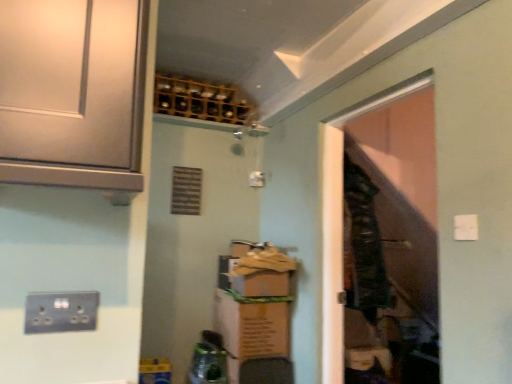
Question: Is dark green fabric laundry at center completely or partially inside metallic socket at lower left?

Choices:
 (A) yes
 (B) no

Answer: (B)

Question: Is metallic socket at lower left to the left of dark green fabric laundry at center from the viewer's perspective?

Choices:
 (A) yes
 (B) no

Answer: (A)

Question: Is metallic socket at lower left not within dark green fabric laundry at center?

Choices:
 (A) yes
 (B) no

Answer: (A)

Question: Is metallic socket at lower left wider than dark green fabric laundry at center?

Choices:
 (A) no
 (B) yes

Answer: (A)

Question: Can you confirm if metallic socket at lower left is thinner than dark green fabric laundry at center?

Choices:
 (A) no
 (B) yes

Answer: (B)

Question: In the image, is metallic socket at lower left positioned in front of or behind white plastic light switch at upper right?

Choices:
 (A) behind
 (B) front

Answer: (B)

Question: Is metallic socket at lower left taller or shorter than white plastic light switch at upper right?

Choices:
 (A) short
 (B) tall

Answer: (B)

Question: From a real-world perspective, is metallic socket at lower left positioned above or below white plastic light switch at upper right?

Choices:
 (A) below
 (B) above

Answer: (A)

Question: In terms of width, does metallic socket at lower left look wider or thinner when compared to white plastic light switch at upper right?

Choices:
 (A) wide
 (B) thin

Answer: (B)

Question: In terms of width, does metallic socket at lower left look wider or thinner when compared to transparent plastic door at right?

Choices:
 (A) wide
 (B) thin

Answer: (B)

Question: Is metallic socket at lower left inside or outside of transparent plastic door at right?

Choices:
 (A) inside
 (B) outside

Answer: (B)

Question: Is metallic socket at lower left to the left or to the right of transparent plastic door at right in the image?

Choices:
 (A) right
 (B) left

Answer: (B)

Question: From a real-world perspective, is metallic socket at lower left above or below transparent plastic door at right?

Choices:
 (A) above
 (B) below

Answer: (B)

Question: From a real-world perspective, is dark green fabric laundry at center positioned above or below satin white door at upper left?

Choices:
 (A) below
 (B) above

Answer: (A)

Question: Is dark green fabric laundry at center bigger or smaller than satin white door at upper left?

Choices:
 (A) big
 (B) small

Answer: (A)